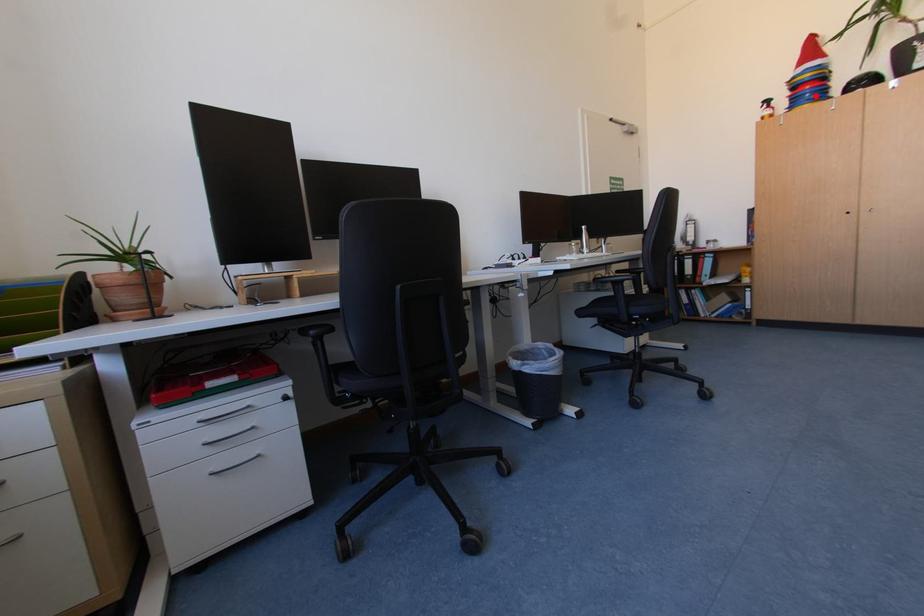
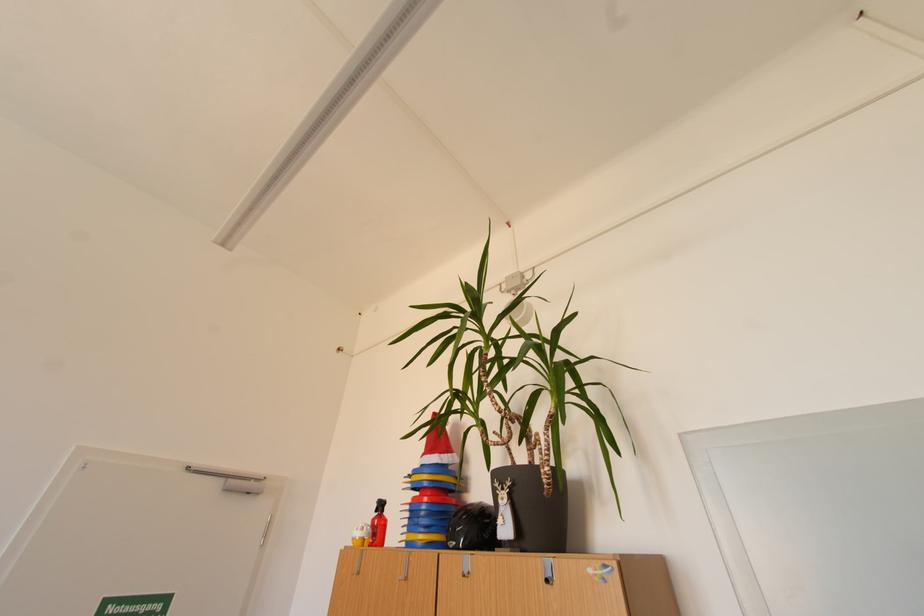
Where in the second image is the point corresponding to the highlighted location from the first image?

(431, 514)